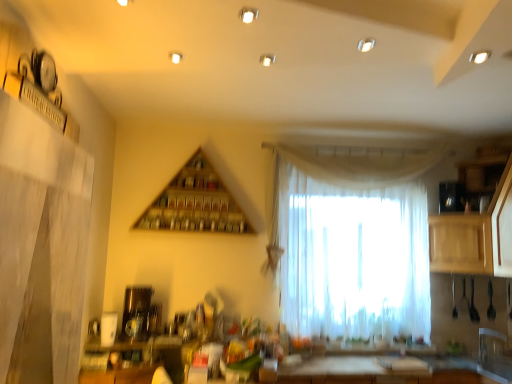
Question: Considering the positions of point (480, 236) and point (187, 192), is point (480, 236) closer or farther from the camera than point (187, 192)?

Choices:
 (A) closer
 (B) farther

Answer: (A)

Question: Based on their sizes in the image, would you say wooden cabinet at right, arranged as the 1th cabinetry when viewed from the back, is bigger or smaller than wooden triangle at upper center?

Choices:
 (A) small
 (B) big

Answer: (B)

Question: Estimate the real-world distances between objects in this image. Which object is farther from the white sheer curtain at center?

Choices:
 (A) wooden cabinet at right, which is the second cabinetry in front-to-back order
 (B) satin gold coffee maker at lower left
 (C) wooden triangle at upper center
 (D) light wood cabinet at right, the 2th cabinetry in the back-to-front sequence

Answer: (B)

Question: Estimate the real-world distances between objects in this image. Which object is farther from the light wood cabinet at right, the 2th cabinetry in the back-to-front sequence?

Choices:
 (A) satin gold coffee maker at lower left
 (B) wooden triangle at upper center
 (C) wooden cabinet at right, which is the second cabinetry in front-to-back order
 (D) white sheer curtain at center

Answer: (A)